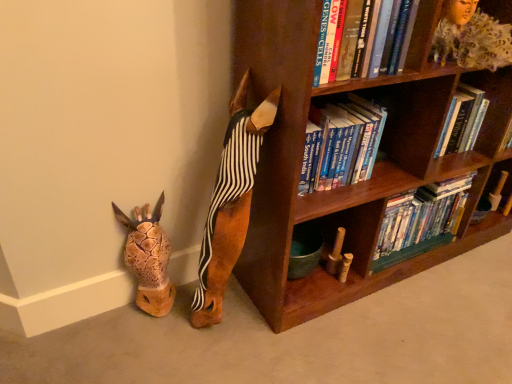
Locate an element on the screen. The height and width of the screenshot is (384, 512). free space between brown wooden dog at center, placed as the first animal when sorted from right to left, and wooden giraffe head at lower left, which ranks as the 2th animal in right-to-left order is located at coordinates (178, 311).